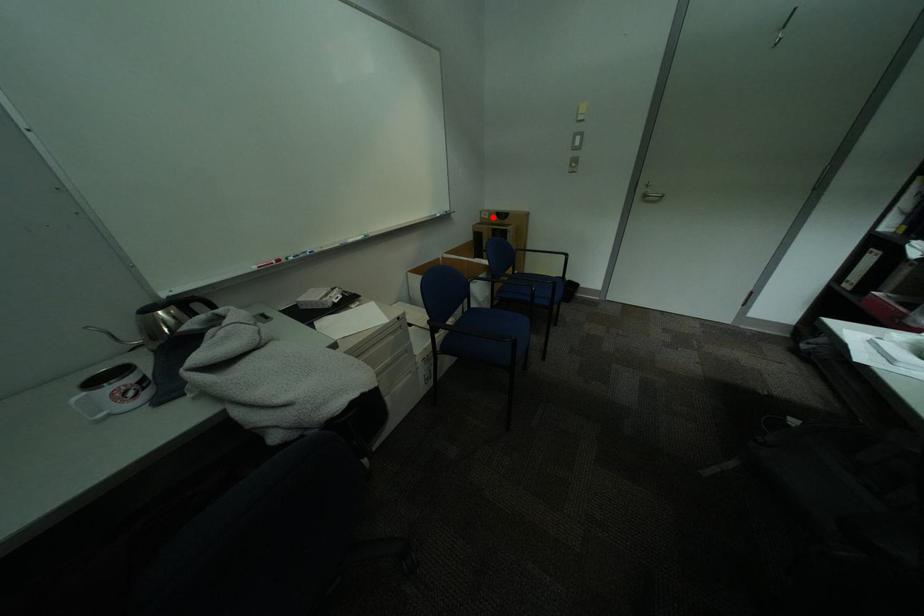
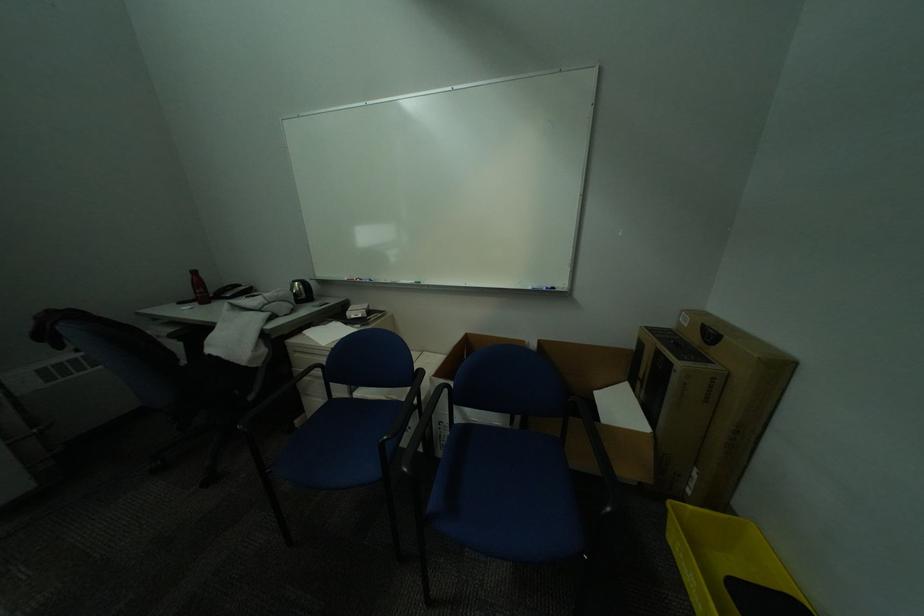
Question: I am providing you with two images of the same scene from different viewpoints. A red point is shown in image1. For the corresponding object point in image2, is it positioned nearer or farther from the camera?

Choices:
 (A) Nearer
 (B) Farther

Answer: (B)